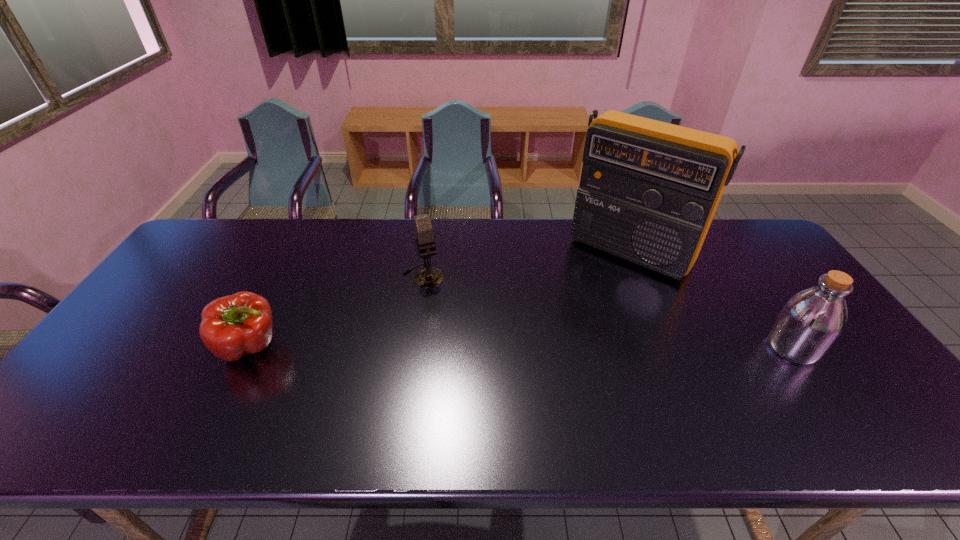
Where is `vacant region located on the front-facing side of the second object from left to right`? Image resolution: width=960 pixels, height=540 pixels. vacant region located on the front-facing side of the second object from left to right is located at coordinates pos(471,380).

I want to click on vacant space located 0.370m on the front-facing side of the radio receiver, so click(x=542, y=355).

At what (x,y) coordinates should I click in order to perform the action: click on vacant space located 0.390m on the front-facing side of the radio receiver. Please return your answer as a coordinate pair (x, y). Image resolution: width=960 pixels, height=540 pixels. Looking at the image, I should click on 538,360.

The height and width of the screenshot is (540, 960). Find the location of `free space located 0.340m on the front-facing side of the radio receiver`. free space located 0.340m on the front-facing side of the radio receiver is located at coordinates (548, 348).

You are a GUI agent. You are given a task and a screenshot of the screen. Output one action in this format:
    pyautogui.click(x=<x>, y=<y>)
    Task: Click on the object located at the far edge
    The height and width of the screenshot is (540, 960).
    Given the screenshot: What is the action you would take?
    pyautogui.click(x=648, y=192)

Find the location of a particular element. object located at the right edge is located at coordinates (811, 321).

Where is `vacant area at the far edge`? vacant area at the far edge is located at coordinates (272, 227).

The height and width of the screenshot is (540, 960). Identify the location of free space at the near edge. (722, 382).

The image size is (960, 540). I want to click on vacant space at the left edge of the desktop, so click(x=196, y=261).

The height and width of the screenshot is (540, 960). What are the coordinates of `vacant space at the far right corner of the desktop` in the screenshot? It's located at (772, 259).